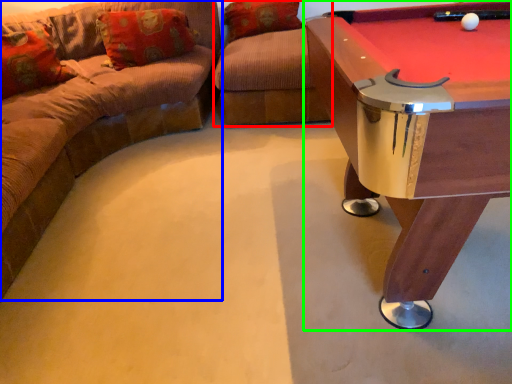
Question: Which object is positioned closest to swivel chair (highlighted by a red box)? Select from studio couch (highlighted by a blue box) and table (highlighted by a green box).

Choices:
 (A) studio couch
 (B) table

Answer: (A)